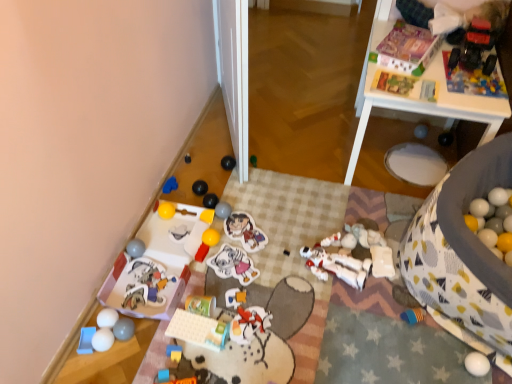
Locate an element on the screen. The height and width of the screenshot is (384, 512). white matte plush at center, which ranks as the 23th toy in left-to-right order is located at coordinates (382, 262).

Measure the distance between point (128, 292) and camera.

Point (128, 292) is 1.50 meters from camera.

This screenshot has height=384, width=512. I want to click on rubber ball at center, the tenth toy when ordered from right to left, so click(x=223, y=210).

Identify the location of black rubber ball at center, the 12th toy from the left. (200, 187).

The image size is (512, 384). I want to click on black rubber ball at center, which is the 18th toy from left to right, so click(x=228, y=162).

Describe the element at coordinates (86, 340) in the screenshot. The height and width of the screenshot is (384, 512). I see `blue plastic tray at lower left, which ranks as the 26th toy in right-to-left order` at that location.

This screenshot has width=512, height=384. I want to click on white matte plush at center, which ranks as the 23th toy in left-to-right order, so coord(382,262).

How far apart are white plastic play mat at center, arranged as the 13th toy when viewed from the right, and white glossy table at upper right?

They are 3.49 feet apart.

From a real-world perspective, which object rests below the other?

white plastic play mat at center, arranged as the 13th toy when viewed from the right.

Which point is more forward, [194,324] or [436,57]?

Point [194,324]

Is white plastic play mat at center, the fourteenth toy in the left-to-right sequence, in front of or behind white glossy table at upper right in the image?

In the image, white plastic play mat at center, the fourteenth toy in the left-to-right sequence, appears in front of white glossy table at upper right.

Is matte gray ball at upper right, the 25th toy viewed from the left, surrounded by yellow matte ball at center, arranged as the 14th toy when viewed from the right?

Definitely not — matte gray ball at upper right, the 25th toy viewed from the left, is not inside yellow matte ball at center, arranged as the 14th toy when viewed from the right.

Based on their positions, is yellow matte ball at center, which appears as the thirteenth toy when viewed from the left, located to the left or right of matte gray ball at upper right, the second toy from the right?

Clearly, yellow matte ball at center, which appears as the thirteenth toy when viewed from the left, is on the left of matte gray ball at upper right, the second toy from the right, in the image.

How many degrees apart are the facing directions of yellow matte ball at center, arranged as the 14th toy when viewed from the right, and matte gray ball at upper right, the 25th toy viewed from the left?

The angular difference between yellow matte ball at center, arranged as the 14th toy when viewed from the right, and matte gray ball at upper right, the 25th toy viewed from the left, is 91.6 degrees.

From a real-world perspective, which is physically above, yellow matte ball at center, which appears as the thirteenth toy when viewed from the left, or matte gray ball at upper right, the 25th toy viewed from the left?

In real-world perspective, matte gray ball at upper right, the 25th toy viewed from the left, is above.

Identify the location of toy that is the 24th one when counting rightward from the white matte balls at lower left, the 25th toy positioned from the right. (475, 48).

Considering the sizes of rubberized plastic toy truck at upper right, the first toy viewed from the right, and white matte balls at lower left, the 25th toy positioned from the right, in the image, is rubberized plastic toy truck at upper right, the first toy viewed from the right, taller or shorter than white matte balls at lower left, the 25th toy positioned from the right,?

Considering their sizes, rubberized plastic toy truck at upper right, the first toy viewed from the right, has more height than white matte balls at lower left, the 25th toy positioned from the right.

Is rubberized plastic toy truck at upper right, which ranks as the 26th toy in left-to-right order, smaller than white matte balls at lower left, which appears as the 2th toy when viewed from the left?

No.

From a real-world perspective, relative to matte gray ball at upper right, the second toy from the right, is green matte ball at center, acting as the 21th toy starting from the left, vertically above or below?

From a real-world perspective, green matte ball at center, acting as the 21th toy starting from the left, is physically below matte gray ball at upper right, the second toy from the right.

Is green matte ball at center, acting as the 21th toy starting from the left, facing away from matte gray ball at upper right, the 25th toy viewed from the left?

No, green matte ball at center, acting as the 21th toy starting from the left, is not facing away from matte gray ball at upper right, the 25th toy viewed from the left.

Is green matte ball at center, acting as the 21th toy starting from the left, behind matte gray ball at upper right, the second toy from the right?

That is False.

Is point (251, 156) closer to camera compared to point (418, 129)?

That is True.

Based on their sizes in the image, would you say matte plastic toy at center, the seventeenth toy positioned from the right, is bigger or smaller than green cardboard can at center, which ranks as the fifteenth toy in left-to-right order?

In the image, matte plastic toy at center, the seventeenth toy positioned from the right, appears to be smaller than green cardboard can at center, which ranks as the fifteenth toy in left-to-right order.

Can you confirm if matte plastic toy at center, arranged as the 10th toy when viewed from the left, is shorter than green cardboard can at center, which ranks as the fifteenth toy in left-to-right order?

Yes, matte plastic toy at center, arranged as the 10th toy when viewed from the left, is shorter than green cardboard can at center, which ranks as the fifteenth toy in left-to-right order.

Considering the sizes of matte plastic toy at center, the seventeenth toy positioned from the right, and green cardboard can at center, which ranks as the fifteenth toy in left-to-right order, in the image, is matte plastic toy at center, the seventeenth toy positioned from the right, wider or thinner than green cardboard can at center, which ranks as the fifteenth toy in left-to-right order,?

In the image, matte plastic toy at center, the seventeenth toy positioned from the right, appears to be more narrow than green cardboard can at center, which ranks as the fifteenth toy in left-to-right order.

Could you tell me if matte plastic toy at center, arranged as the 10th toy when viewed from the left, is facing green cardboard can at center, which ranks as the fifteenth toy in left-to-right order?

No, matte plastic toy at center, arranged as the 10th toy when viewed from the left, is not turned towards green cardboard can at center, which ranks as the fifteenth toy in left-to-right order.

Is blue fabric toy at lower left, acting as the 21th toy starting from the right, facing away from yellow matte ball at center, which appears as the thirteenth toy when viewed from the left?

No, yellow matte ball at center, which appears as the thirteenth toy when viewed from the left, is not at the back of blue fabric toy at lower left, acting as the 21th toy starting from the right.

From the image's perspective, does blue fabric toy at lower left, acting as the 21th toy starting from the right, appear lower than yellow matte ball at center, arranged as the 14th toy when viewed from the right?

No, from the image's perspective, blue fabric toy at lower left, acting as the 21th toy starting from the right, is not below yellow matte ball at center, arranged as the 14th toy when viewed from the right.

The width and height of the screenshot is (512, 384). Find the location of `the 5th toy positioned below the yellow matte ball at center, arranged as the 14th toy when viewed from the right (from a real-world perspective)`. the 5th toy positioned below the yellow matte ball at center, arranged as the 14th toy when viewed from the right (from a real-world perspective) is located at coordinates (170, 185).

Considering the relative sizes of blue fabric toy at lower left, acting as the 21th toy starting from the right, and yellow matte ball at center, arranged as the 14th toy when viewed from the right, in the image provided, is blue fabric toy at lower left, acting as the 21th toy starting from the right, smaller than yellow matte ball at center, arranged as the 14th toy when viewed from the right,?

Incorrect, blue fabric toy at lower left, acting as the 21th toy starting from the right, is not smaller in size than yellow matte ball at center, arranged as the 14th toy when viewed from the right.

Which is in front, yellow rubber ball at center, the 16th toy positioned from the left, or rubber ball at center, which ranks as the seventeenth toy in left-to-right order?

Positioned in front is yellow rubber ball at center, the 16th toy positioned from the left.

Is yellow rubber ball at center, the 16th toy positioned from the left, turned away from rubber ball at center, the tenth toy when ordered from right to left?

That's not correct — yellow rubber ball at center, the 16th toy positioned from the left, is not looking away from rubber ball at center, the tenth toy when ordered from right to left.

Is yellow rubber ball at center, which ranks as the eleventh toy in right-to-left order, not within rubber ball at center, which ranks as the seventeenth toy in left-to-right order?

Absolutely, yellow rubber ball at center, which ranks as the eleventh toy in right-to-left order, is external to rubber ball at center, which ranks as the seventeenth toy in left-to-right order.

The image size is (512, 384). What are the coordinates of `the 3rd toy behind the yellow rubber ball at center, which ranks as the eleventh toy in right-to-left order` in the screenshot? It's located at (223, 210).

Locate an element on the screen. The image size is (512, 384). table on the right of the white plastic play mat at center, the fourteenth toy in the left-to-right sequence is located at coordinates (418, 102).

At what (x,y) coordinates should I click in order to perform the action: click on the 6th toy in front when counting from the matte gray ball at upper right, the second toy from the right. Please return your answer as a coordinate pair (x, y). This screenshot has width=512, height=384. Looking at the image, I should click on (207, 216).

Which object lies nearer to the anchor point rubber yellow block at lower center, marked as the eleventh toy in a left-to-right arrangement, black rubber ball at center, which is the 18th toy from left to right, or yellow rubber ball at lower left, the 7th toy from the left?

yellow rubber ball at lower left, the 7th toy from the left.

Looking at the image, which one is located further to white matte sticker at center, which is the nineteenth toy from left to right, yellow rubber ball at lower left, which appears as the 20th toy when viewed from the right, or matte plastic sticker at center, the seventh toy when ordered from right to left?

yellow rubber ball at lower left, which appears as the 20th toy when viewed from the right, is further to white matte sticker at center, which is the nineteenth toy from left to right.

Which object lies nearer to the anchor point white matte balls at lower left, the 25th toy positioned from the right, matte plastic toy at center, the seventeenth toy positioned from the right, or green cardboard can at center, the twelfth toy when ordered from right to left?

green cardboard can at center, the twelfth toy when ordered from right to left, is closer to white matte balls at lower left, the 25th toy positioned from the right.

Based on their spatial positions, is matte plastic toy at lower left, the 5th toy in the left-to-right sequence, or rubberized plastic toy truck at upper right, which ranks as the 26th toy in left-to-right order, further from green matte ball at center, acting as the 21th toy starting from the left?

rubberized plastic toy truck at upper right, which ranks as the 26th toy in left-to-right order, lies further to green matte ball at center, acting as the 21th toy starting from the left, than the other object.

Which object lies nearer to the anchor point black rubber ball at center, positioned as the fifteenth toy in right-to-left order, white matte balls at lower left, which appears as the 2th toy when viewed from the left, or matte plastic toy at center, the seventeenth toy positioned from the right?

Among the two, matte plastic toy at center, the seventeenth toy positioned from the right, is located nearer to black rubber ball at center, positioned as the fifteenth toy in right-to-left order.

When comparing their distances from matte gray ball at upper right, the second toy from the right, does white matte doll at center, acting as the 5th toy starting from the right, or rubber ball at center, the tenth toy when ordered from right to left, seem further?

rubber ball at center, the tenth toy when ordered from right to left, is further to matte gray ball at upper right, the second toy from the right.

Based on their spatial positions, is black rubber ball at center, which is the 18th toy from left to right, or patterned fabric bean bag at lower right further from white matte balls at lower left, the 25th toy positioned from the right?

Among the two, patterned fabric bean bag at lower right is located further to white matte balls at lower left, the 25th toy positioned from the right.

Estimate the real-world distances between objects in this image. Which object is closer to matte plastic toy at lower left, which appears as the 22th toy when viewed from the right, white matte doll at center, acting as the 5th toy starting from the right, or matte cardboard box at upper right, which is the 24th toy in left-to-right order?

white matte doll at center, acting as the 5th toy starting from the right, is closer to matte plastic toy at lower left, which appears as the 22th toy when viewed from the right.

At what (x,y) coordinates should I click in order to perform the action: click on table between black rubber ball at center, which appears as the 9th toy when viewed from the right, and matte gray ball at upper right, the 25th toy viewed from the left, from left to right. Please return your answer as a coordinate pair (x, y). Looking at the image, I should click on (418, 102).

Locate an element on the screen. This screenshot has height=384, width=512. table between yellow matte ball at center, which appears as the thirteenth toy when viewed from the left, and rubberized plastic toy truck at upper right, the first toy viewed from the right is located at coordinates (418, 102).

The height and width of the screenshot is (384, 512). I want to click on table between black rubber ball at center, the 12th toy from the left, and rubberized plastic toy truck at upper right, which ranks as the 26th toy in left-to-right order, from left to right, so click(418, 102).

Image resolution: width=512 pixels, height=384 pixels. I want to click on table between rubber ball at center, the tenth toy when ordered from right to left, and rubberized plastic toy truck at upper right, the first toy viewed from the right, so click(x=418, y=102).